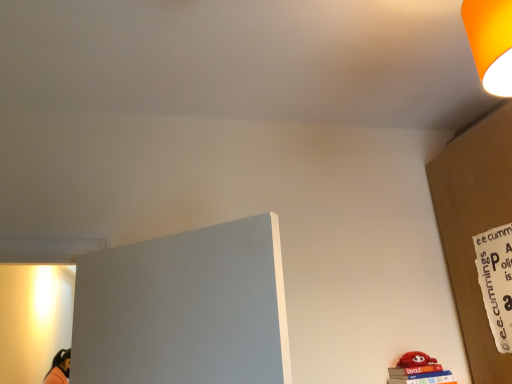
Question: Relative to white paper sign at right, is orange matte lampshade at upper right in front or behind?

Choices:
 (A) behind
 (B) front

Answer: (B)

Question: From the image's perspective, relative to white paper sign at right, is orange matte lampshade at upper right above or below?

Choices:
 (A) above
 (B) below

Answer: (A)

Question: Considering the positions of orange matte lampshade at upper right and white paper sign at right in the image, is orange matte lampshade at upper right taller or shorter than white paper sign at right?

Choices:
 (A) short
 (B) tall

Answer: (A)

Question: Based on their sizes in the image, would you say white paper sign at right is bigger or smaller than orange matte lampshade at upper right?

Choices:
 (A) small
 (B) big

Answer: (A)

Question: Looking at their shapes, would you say white paper sign at right is wider or thinner than orange matte lampshade at upper right?

Choices:
 (A) thin
 (B) wide

Answer: (A)

Question: From a real-world perspective, is white paper sign at right physically located above or below orange matte lampshade at upper right?

Choices:
 (A) above
 (B) below

Answer: (B)

Question: Does point (509, 304) appear closer or farther from the camera than point (473, 16)?

Choices:
 (A) closer
 (B) farther

Answer: (B)